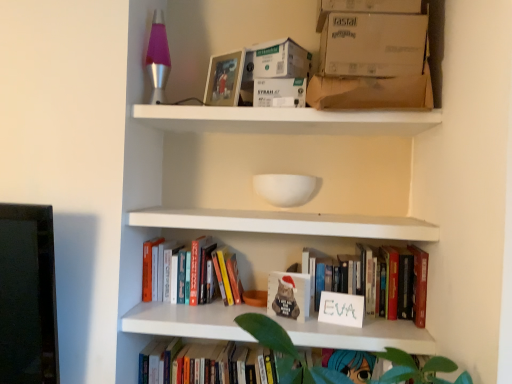
Question: Is matte plastic picture frame at upper center facing towards hardcover books at center, marked as the first book in a top-to-bottom arrangement?

Choices:
 (A) yes
 (B) no

Answer: (B)

Question: Considering the relative positions of matte plastic picture frame at upper center and hardcover books at center, acting as the 3th book starting from the bottom, in the image provided, is matte plastic picture frame at upper center to the left of hardcover books at center, acting as the 3th book starting from the bottom, from the viewer's perspective?

Choices:
 (A) no
 (B) yes

Answer: (A)

Question: Considering the relative sizes of matte plastic picture frame at upper center and hardcover books at center, acting as the 3th book starting from the bottom, in the image provided, is matte plastic picture frame at upper center taller than hardcover books at center, acting as the 3th book starting from the bottom,?

Choices:
 (A) no
 (B) yes

Answer: (B)

Question: Does matte plastic picture frame at upper center have a smaller size compared to hardcover books at center, acting as the 3th book starting from the bottom?

Choices:
 (A) yes
 (B) no

Answer: (A)

Question: Considering the relative sizes of matte plastic picture frame at upper center and hardcover books at center, acting as the 3th book starting from the bottom, in the image provided, is matte plastic picture frame at upper center shorter than hardcover books at center, acting as the 3th book starting from the bottom,?

Choices:
 (A) yes
 (B) no

Answer: (B)

Question: Is the position of matte plastic picture frame at upper center more distant than that of hardcover books at center, acting as the 3th book starting from the bottom?

Choices:
 (A) no
 (B) yes

Answer: (A)

Question: Is brown cardboard box at upper center, which is the first cardboard box in bottom-to-top order, at the back of hardcover books at center, marked as the first book in a top-to-bottom arrangement?

Choices:
 (A) yes
 (B) no

Answer: (B)

Question: Is brown cardboard box at upper center, which is the first cardboard box in bottom-to-top order, located within hardcover books at center, marked as the first book in a top-to-bottom arrangement?

Choices:
 (A) no
 (B) yes

Answer: (A)

Question: From the image's perspective, is hardcover books at center, marked as the first book in a top-to-bottom arrangement, beneath brown cardboard box at upper center, the third cardboard box viewed from the top?

Choices:
 (A) no
 (B) yes

Answer: (B)

Question: From the image's perspective, is hardcover books at center, acting as the 3th book starting from the bottom, above brown cardboard box at upper center, the third cardboard box viewed from the top?

Choices:
 (A) no
 (B) yes

Answer: (A)

Question: Considering the relative positions of hardcover books at center, acting as the 3th book starting from the bottom, and brown cardboard box at upper center, the third cardboard box viewed from the top, in the image provided, is hardcover books at center, acting as the 3th book starting from the bottom, to the right of brown cardboard box at upper center, the third cardboard box viewed from the top, from the viewer's perspective?

Choices:
 (A) no
 (B) yes

Answer: (A)

Question: Can you confirm if hardcover books at center, marked as the first book in a top-to-bottom arrangement, is shorter than brown cardboard box at upper center, the third cardboard box viewed from the top?

Choices:
 (A) no
 (B) yes

Answer: (A)

Question: Considering the relative sizes of white cardboard box at upper center and white matte shelf at upper center in the image provided, is white cardboard box at upper center smaller than white matte shelf at upper center?

Choices:
 (A) no
 (B) yes

Answer: (B)